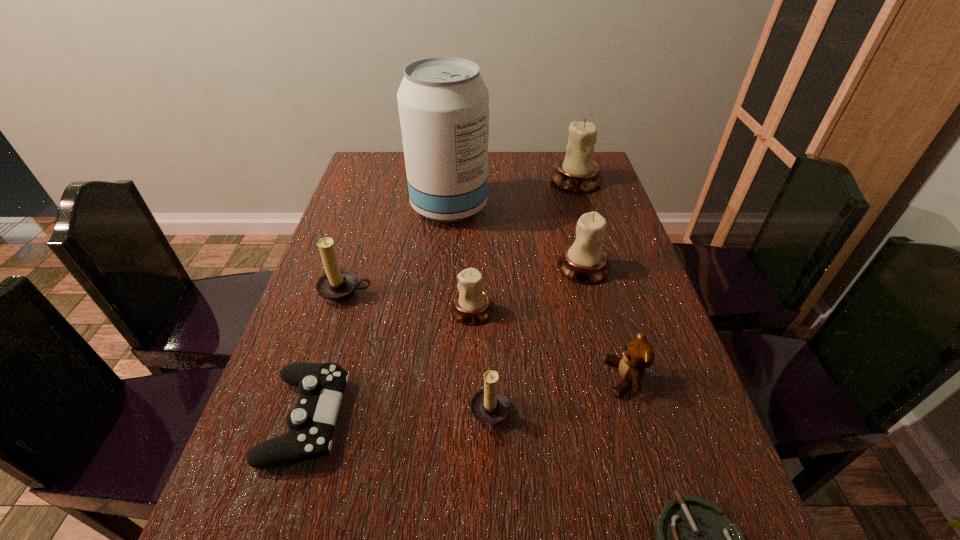
In order to click on vacant space in between the nearer brown candle holder and the biggest white candle holder in this screenshot , I will do `click(533, 299)`.

Identify which object is the nearest to the tallest candle holder. Please provide its 2D coordinates. Your answer should be formatted as a tuple, i.e. [(x, y)], where the tuple contains the x and y coordinates of a point satisfying the conditions above.

[(443, 102)]

Select which object is the closest to the alcohol. Please provide its 2D coordinates. Your answer should be formatted as a tuple, i.e. [(x, y)], where the tuple contains the x and y coordinates of a point satisfying the conditions above.

[(585, 261)]

Image resolution: width=960 pixels, height=540 pixels. I want to click on candle holder identified as the fourth closest to the alcohol, so click(x=471, y=306).

Where is `candle holder that can be found as the fourth closest to the second smallest white candle holder`? The width and height of the screenshot is (960, 540). candle holder that can be found as the fourth closest to the second smallest white candle holder is located at coordinates (337, 285).

Locate which white candle holder ranks in proximity to the farthest candle holder. Please provide its 2D coordinates. Your answer should be formatted as a tuple, i.e. [(x, y)], where the tuple contains the x and y coordinates of a point satisfying the conditions above.

[(585, 261)]

Identify which white candle holder is the closest to the teddy bear. Please provide its 2D coordinates. Your answer should be formatted as a tuple, i.e. [(x, y)], where the tuple contains the x and y coordinates of a point satisfying the conditions above.

[(585, 261)]